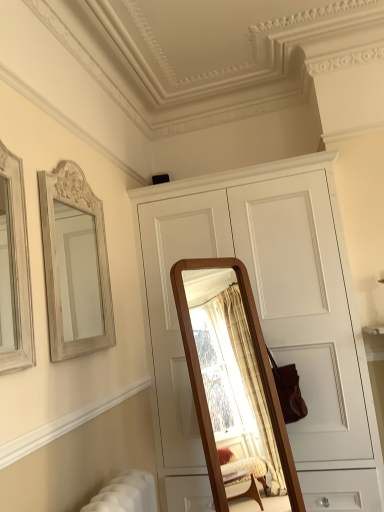
This screenshot has width=384, height=512. What are the coordinates of `free location above white carved wood mirror at upper left (from a real-world perspective)` in the screenshot? It's located at (69, 156).